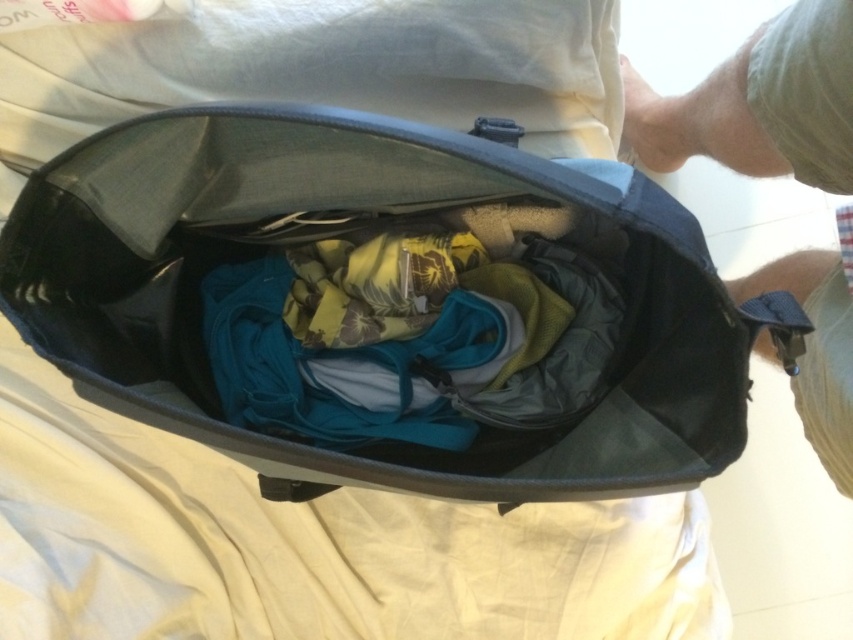
You are trying to organize your luggage for a trip. You have a matte black bag at center and skinny jeans at right. Based on the image, which item is located to the left of the other?

The matte black bag at center is positioned on the left side of skinny jeans at right, so the matte black bag at center is to the left of the skinny jeans at right.

You are trying to organize your luggage. You have a pair of skinny jeans at right and khaki cotton shorts at lower right. If you want to place them side by side in your bag, will they fit within the bag without overlapping?

The skinny jeans at right is 2.45 centimeters away from khaki cotton shorts at lower right, so they can be placed side by side in the bag without overlapping as there is enough space between them.